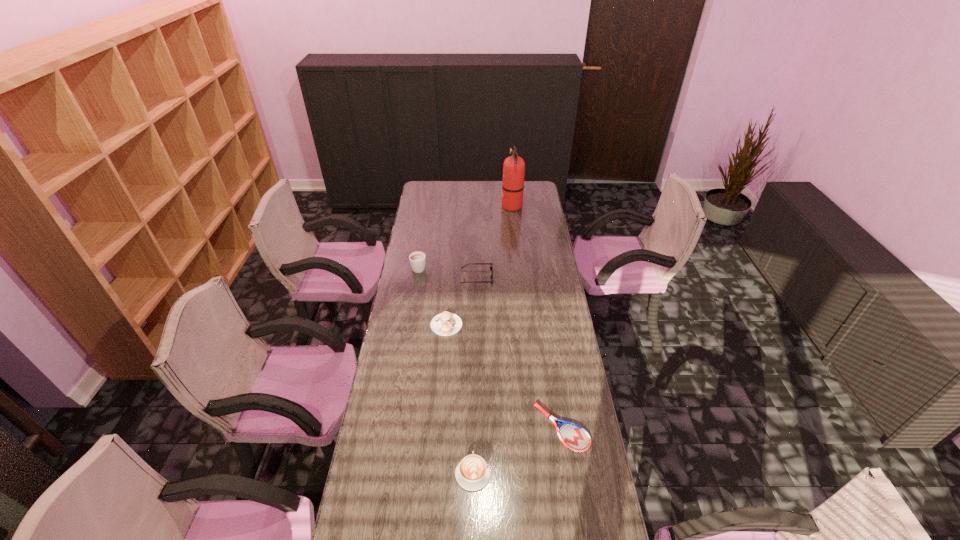
Locate an element on the screen. the shortest object is located at coordinates (573, 436).

Identify the location of free space located 0.400m on the side of the fire extinguisher with the nozzle and handle. This screenshot has width=960, height=540. (432, 206).

You are a GUI agent. You are given a task and a screenshot of the screen. Output one action in this format:
    pyautogui.click(x=<x>, y=<y>)
    Task: Click on the vacant region located on the side of the fire extinguisher with the nozzle and handle
    The height and width of the screenshot is (540, 960).
    Given the screenshot: What is the action you would take?
    (x=455, y=206)

You are a GUI agent. You are given a task and a screenshot of the screen. Output one action in this format:
    pyautogui.click(x=<x>, y=<y>)
    Task: Click on the vacant space located 0.080m on the side of the fire extinguisher with the nozzle and handle
    This screenshot has width=960, height=540.
    Given the screenshot: What is the action you would take?
    pyautogui.click(x=488, y=206)

Where is `free space located 0.400m with the handle on the side of the tallest cappuccino`? free space located 0.400m with the handle on the side of the tallest cappuccino is located at coordinates (427, 217).

Where is `vacant point located with the handle on the side of the tallest cappuccino`? This screenshot has width=960, height=540. vacant point located with the handle on the side of the tallest cappuccino is located at coordinates (423, 242).

The image size is (960, 540). Find the location of `free point located 0.060m with the handle on the side of the tallest cappuccino`. free point located 0.060m with the handle on the side of the tallest cappuccino is located at coordinates (421, 253).

This screenshot has height=540, width=960. What are the coordinates of `vacant space positioned on the front-facing side of the sunglasses` in the screenshot? It's located at (541, 276).

The height and width of the screenshot is (540, 960). Find the location of `vacant area located on the side of the nearest object with the handle`. vacant area located on the side of the nearest object with the handle is located at coordinates (474, 366).

At what (x,y) coordinates should I click in order to perform the action: click on free location located on the side of the nearest object with the handle. Please return your answer as a coordinate pair (x, y). This screenshot has height=540, width=960. Looking at the image, I should click on (473, 409).